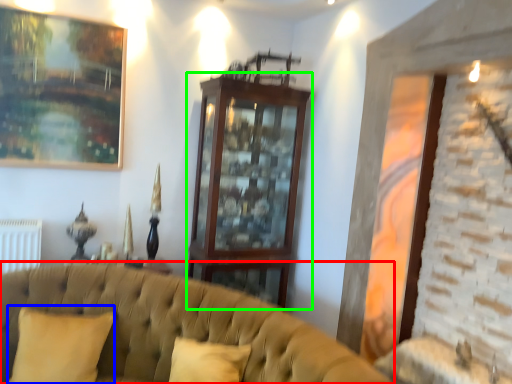
Question: Estimate the real-world distances between objects in this image. Which object is closer to studio couch (highlighted by a red box), pillow (highlighted by a blue box) or dresser (highlighted by a green box)?

Choices:
 (A) pillow
 (B) dresser

Answer: (A)